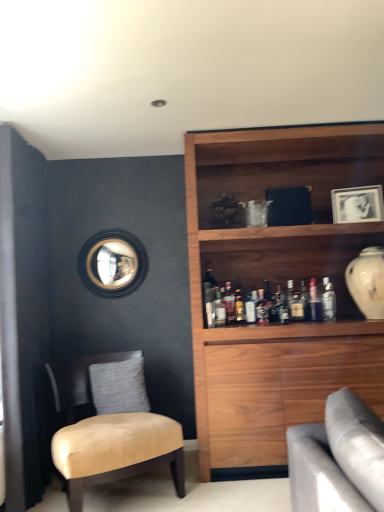
The width and height of the screenshot is (384, 512). I want to click on free space above matte black mirror at upper left (from a real-world perspective), so pyautogui.click(x=117, y=224).